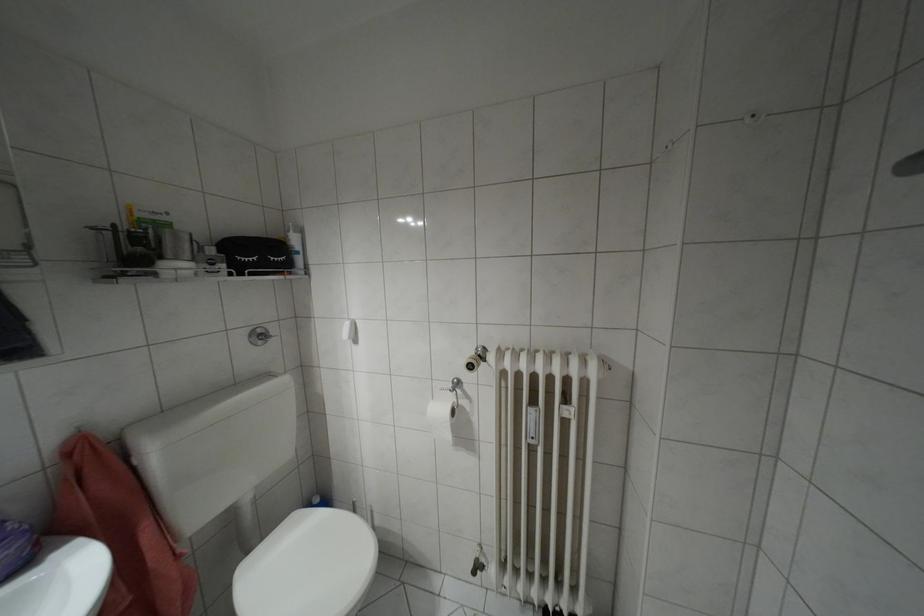
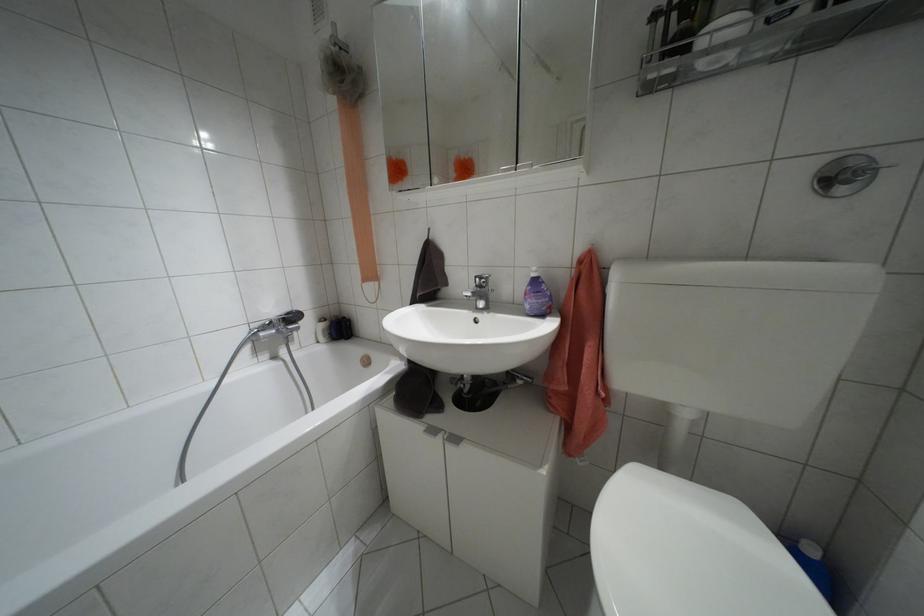
Locate, in the second image, the point that corresponds to point 260,341 in the first image.

(841, 190)